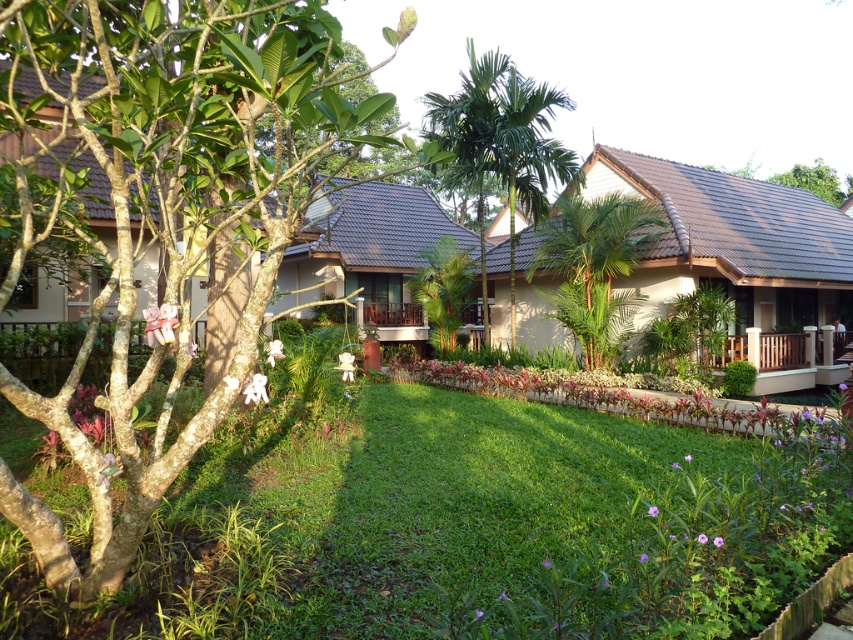
Question: Among these points, which one is farthest from the camera?

Choices:
 (A) (815, 160)
 (B) (569, 225)
 (C) (434, 289)
 (D) (606, 636)

Answer: (A)

Question: Can you confirm if green grass at center is positioned below smooth white tree at left?

Choices:
 (A) no
 (B) yes

Answer: (B)

Question: Based on their relative distances, which object is nearer to the green grass at center?

Choices:
 (A) green leafy tree at upper right
 (B) green leafy palm at center
 (C) smooth white tree at left
 (D) green leafy palm tree at center

Answer: (C)

Question: Does green grass at center appear on the right side of smooth white tree at left?

Choices:
 (A) no
 (B) yes

Answer: (B)

Question: Is smooth white tree at left to the right of green leafy palm tree at center from the viewer's perspective?

Choices:
 (A) yes
 (B) no

Answer: (B)

Question: Among these objects, which one is nearest to the camera?

Choices:
 (A) green grass at center
 (B) green leafy tree at center

Answer: (A)